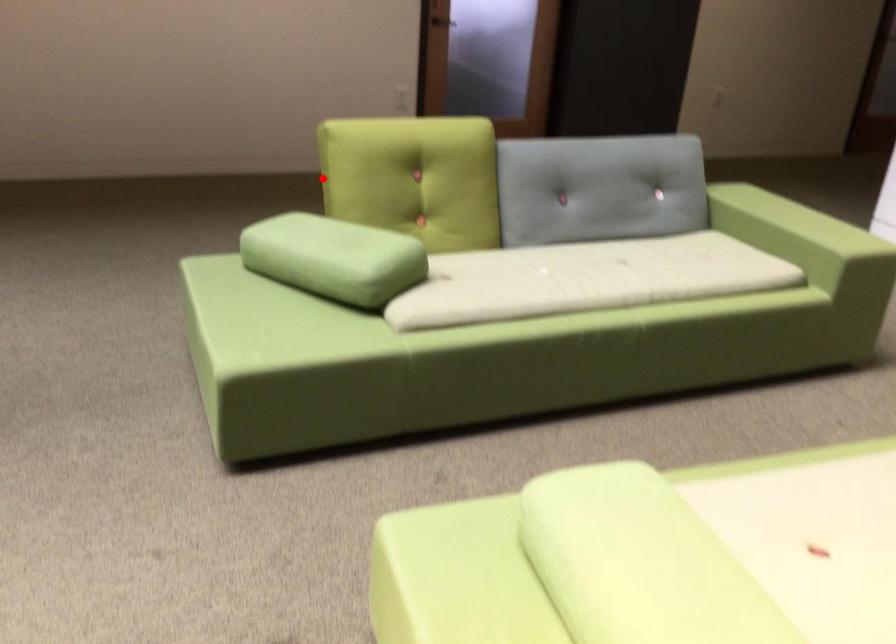
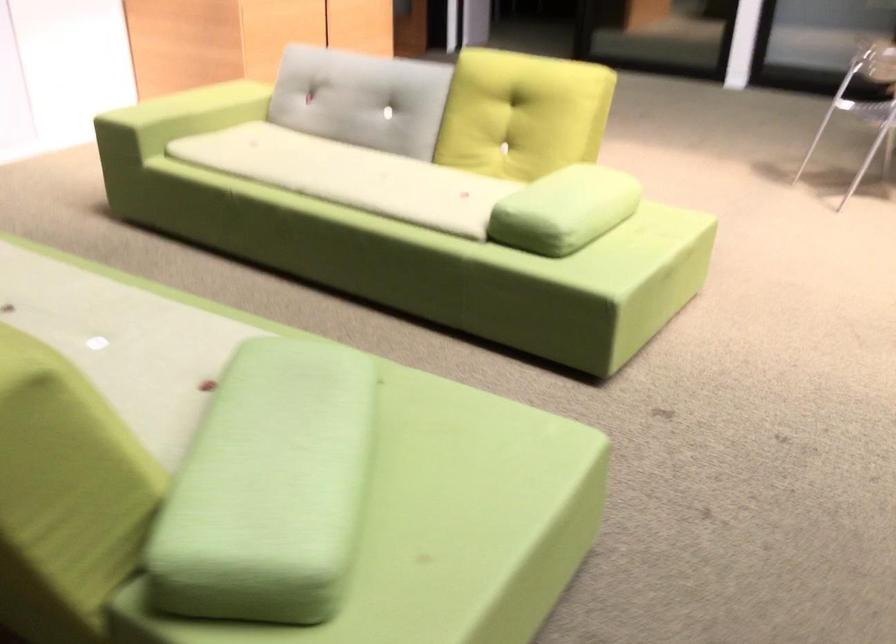
Find the pixel in the second image that matches the highlighted location in the first image.

(64, 497)